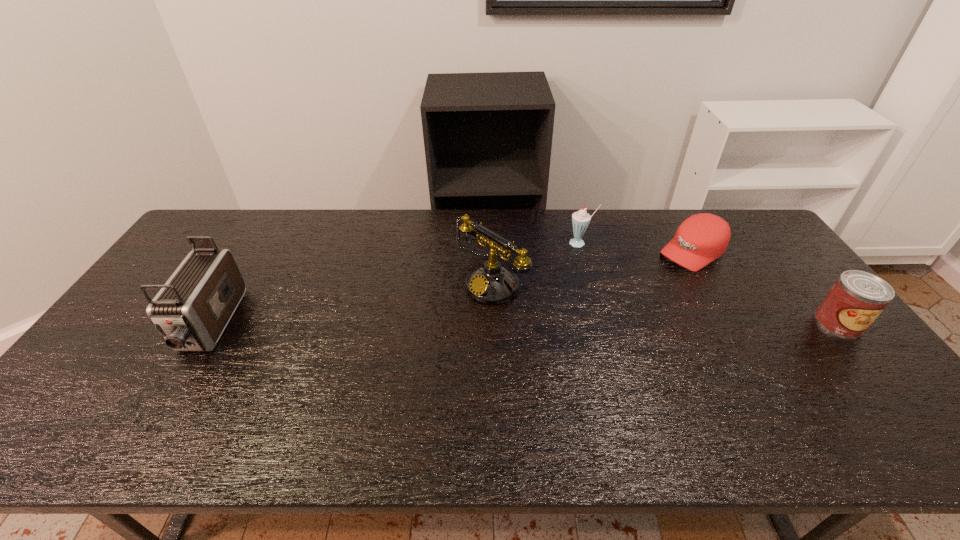
Locate an element on the screen. This screenshot has width=960, height=540. vacant point located between the can and the fourth object from right to left is located at coordinates (664, 303).

Locate an element on the screen. The image size is (960, 540). vacant area that lies between the leftmost object and the milkshake is located at coordinates (395, 284).

Identify the location of vacant space that's between the cap and the fourth tallest object. (765, 287).

Identify the location of unoccupied area between the rightmost object and the milkshake. (708, 283).

The width and height of the screenshot is (960, 540). Find the location of `vacant area between the fourth object from left to right and the leftmost object`. vacant area between the fourth object from left to right and the leftmost object is located at coordinates (451, 289).

The height and width of the screenshot is (540, 960). I want to click on free point between the cap and the telephone, so pos(591,268).

Point out which object is positioned as the fourth nearest to the fourth object from left to right. Please provide its 2D coordinates. Your answer should be formatted as a tuple, i.e. [(x, y)], where the tuple contains the x and y coordinates of a point satisfying the conditions above.

[(191, 311)]

You are a GUI agent. You are given a task and a screenshot of the screen. Output one action in this format:
    pyautogui.click(x=<x>, y=<y>)
    Task: Click on the object that can be found as the closest to the third object from left to right
    This screenshot has width=960, height=540.
    Given the screenshot: What is the action you would take?
    point(491,283)

You are a GUI agent. You are given a task and a screenshot of the screen. Output one action in this format:
    pyautogui.click(x=<x>, y=<y>)
    Task: Click on the vacant space that satisfies the following two spatial constraints: 1. on the back side of the telephone; 2. on the right side of the third object from left to right
    The width and height of the screenshot is (960, 540).
    Given the screenshot: What is the action you would take?
    pyautogui.click(x=490, y=243)

Image resolution: width=960 pixels, height=540 pixels. In order to click on vacant space that satisfies the following two spatial constraints: 1. on the front side of the cap; 2. on the left side of the milkshake in this screenshot , I will do (x=582, y=252).